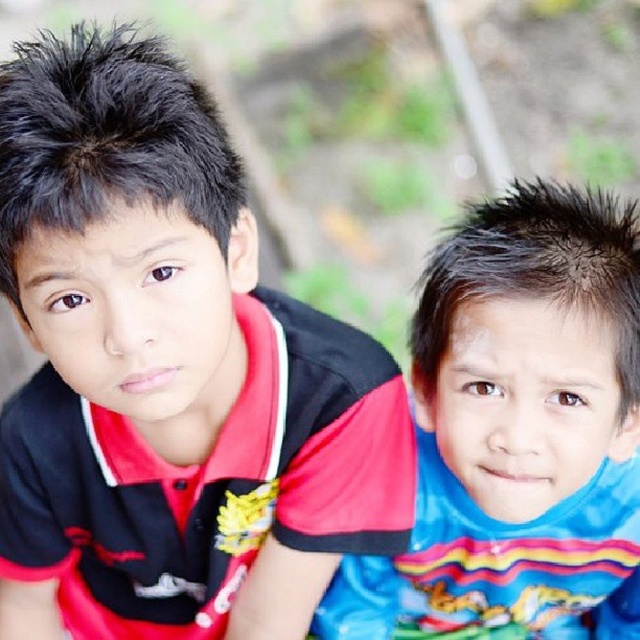
Question: Which of the following is the farthest from the observer?

Choices:
 (A) red matte shirt at upper left
 (B) blue shiny shirt at center

Answer: (B)

Question: Can you confirm if red matte shirt at upper left is positioned to the left of blue shiny shirt at center?

Choices:
 (A) no
 (B) yes

Answer: (B)

Question: Does red matte shirt at upper left appear on the right side of blue shiny shirt at center?

Choices:
 (A) yes
 (B) no

Answer: (B)

Question: Can you confirm if red matte shirt at upper left is positioned above blue shiny shirt at center?

Choices:
 (A) yes
 (B) no

Answer: (A)